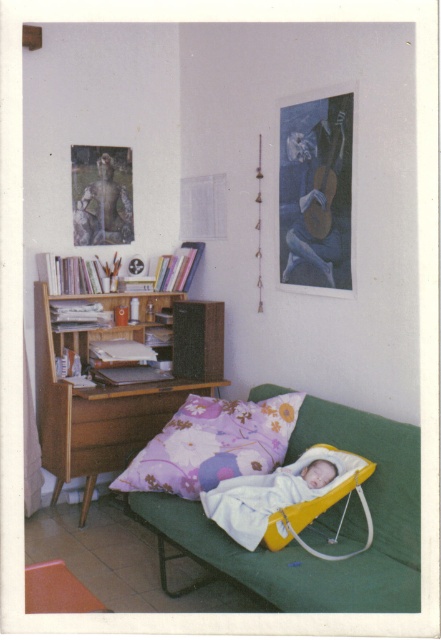
You are designing a layout for a nursery and need to place the yellow plastic infant bed at center and the wooden carved statue at upper left. Considering their heights, which object should be placed lower to ensure they don not block each other?

The yellow plastic infant bed at center is shorter than the wooden carved statue at upper left, so placing the statue higher up and the bed lower would prevent them from blocking each other.